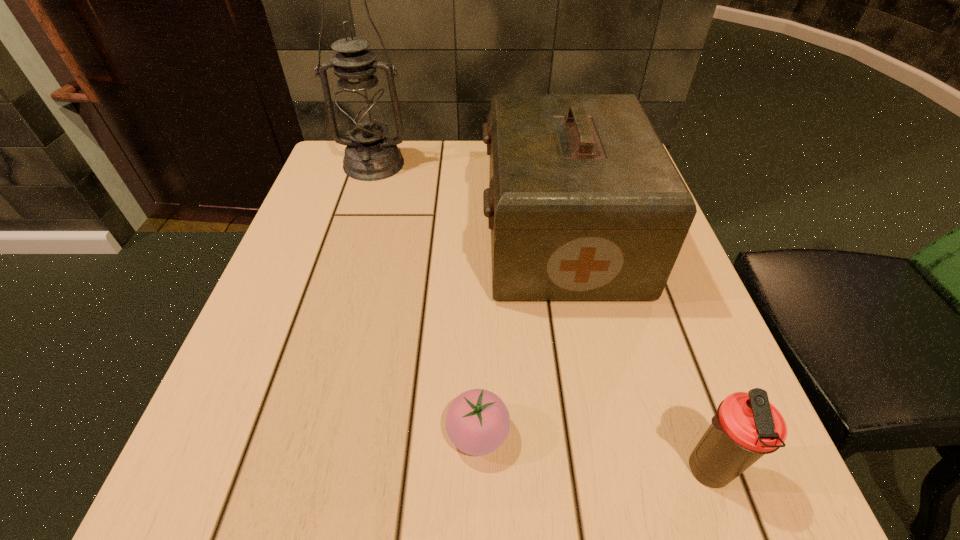
At what (x,y) coordinates should I click in order to perform the action: click on blank region between the thermos bottle and the shortest object. Please return your answer as a coordinate pair (x, y). The image size is (960, 540). Looking at the image, I should click on (592, 452).

At what (x,y) coordinates should I click in order to perform the action: click on free space between the leftmost object and the thermos bottle. Please return your answer as a coordinate pair (x, y). The image size is (960, 540). Looking at the image, I should click on (540, 317).

Where is `vacant space that is in between the third shortest object and the third tallest object`? The width and height of the screenshot is (960, 540). vacant space that is in between the third shortest object and the third tallest object is located at coordinates (634, 354).

In order to click on free space between the tallest object and the first-aid kit in this screenshot , I will do `click(468, 201)`.

What are the coordinates of `empty space that is in between the tomato and the second tallest object` in the screenshot? It's located at (519, 336).

Image resolution: width=960 pixels, height=540 pixels. Find the location of `empty location between the shortest object and the thermos bottle`. empty location between the shortest object and the thermos bottle is located at coordinates (592, 452).

Identify which object is located as the third nearest to the thermos bottle. Please provide its 2D coordinates. Your answer should be formatted as a tuple, i.e. [(x, y)], where the tuple contains the x and y coordinates of a point satisfying the conditions above.

[(363, 112)]

Locate which object is the second closest to the tomato. Please provide its 2D coordinates. Your answer should be formatted as a tuple, i.e. [(x, y)], where the tuple contains the x and y coordinates of a point satisfying the conditions above.

[(747, 426)]

Where is `vacant space that satisfies the following two spatial constraints: 1. on the front side of the farthest object; 2. on the left side of the thermos bottle`? vacant space that satisfies the following two spatial constraints: 1. on the front side of the farthest object; 2. on the left side of the thermos bottle is located at coordinates (279, 470).

The width and height of the screenshot is (960, 540). What are the coordinates of `free space that satisfies the following two spatial constraints: 1. on the front side of the farthest object; 2. on the left side of the first-aid kit` in the screenshot? It's located at (351, 238).